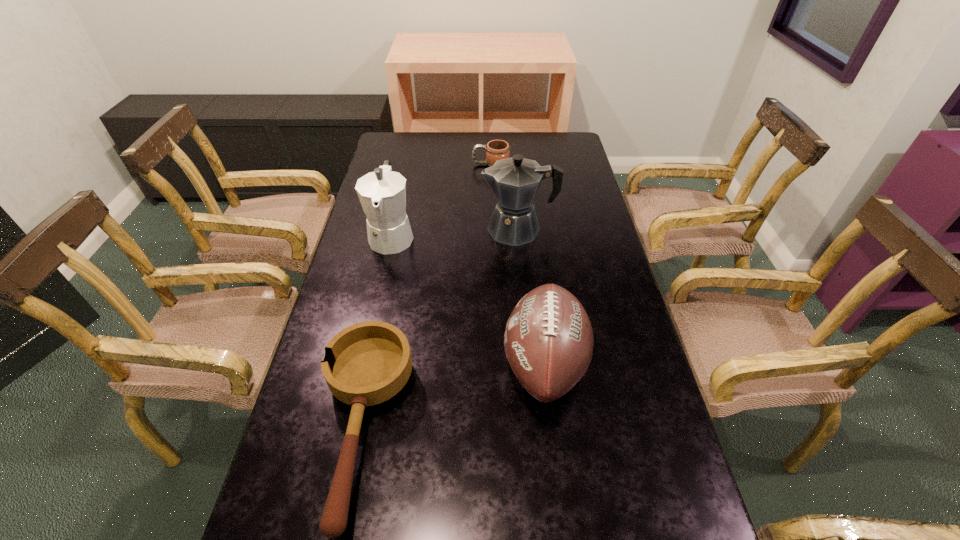
Identify the location of the right coffeepot. The image size is (960, 540). (515, 181).

Identify the location of the left coffeepot. (382, 193).

You are a GUI agent. You are given a task and a screenshot of the screen. Output one action in this format:
    pyautogui.click(x=<x>, y=<y>)
    Task: Click on the football (American)
    
    Given the screenshot: What is the action you would take?
    pyautogui.click(x=548, y=340)

Locate an element on the screen. This screenshot has height=540, width=960. mug is located at coordinates (496, 150).

The height and width of the screenshot is (540, 960). In order to click on free region located 0.110m at the spout of the right coffeepot in this screenshot , I will do point(447,229).

Image resolution: width=960 pixels, height=540 pixels. Identify the location of free space located 0.290m at the spout of the right coffeepot. (394, 229).

Where is `vacant space located at the spout of the right coffeepot`? This screenshot has width=960, height=540. vacant space located at the spout of the right coffeepot is located at coordinates (363, 229).

Locate an element on the screen. blank space located 0.110m at the spout of the left coffeepot is located at coordinates (381, 287).

At what (x,y) coordinates should I click in order to perform the action: click on vacant space located on the left of the third shortest object. Please return your answer as a coordinate pair (x, y). Image resolution: width=960 pixels, height=540 pixels. Looking at the image, I should click on pyautogui.click(x=341, y=363).

The image size is (960, 540). Identify the location of vacant space located 0.220m on the side of the farthest object with the handle. (417, 165).